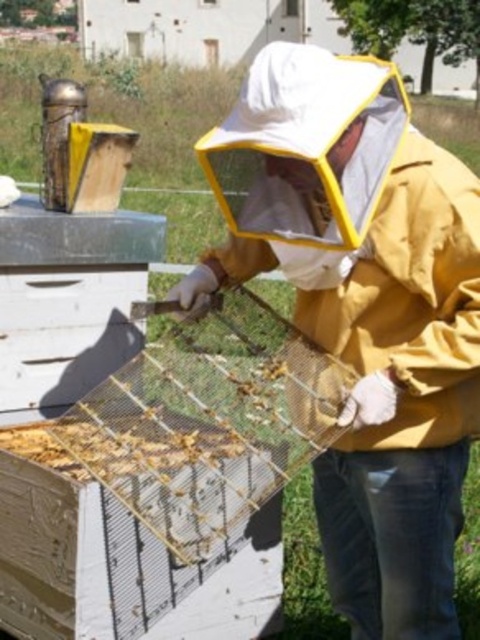
Does yellow matte beekeeper suit at center appear over wooden frame at center?

Correct, yellow matte beekeeper suit at center is located above wooden frame at center.

Identify the location of yellow matte beekeeper suit at center. (362, 312).